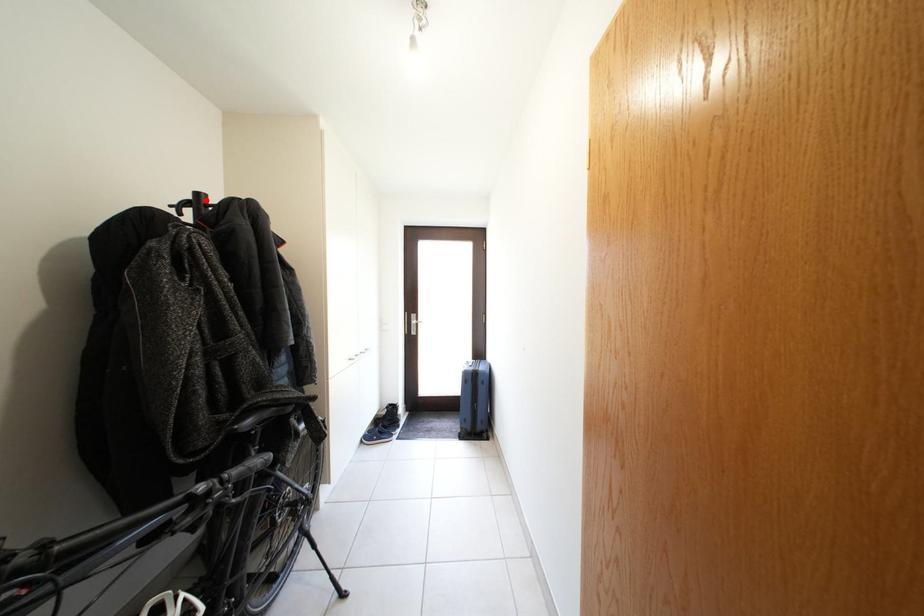
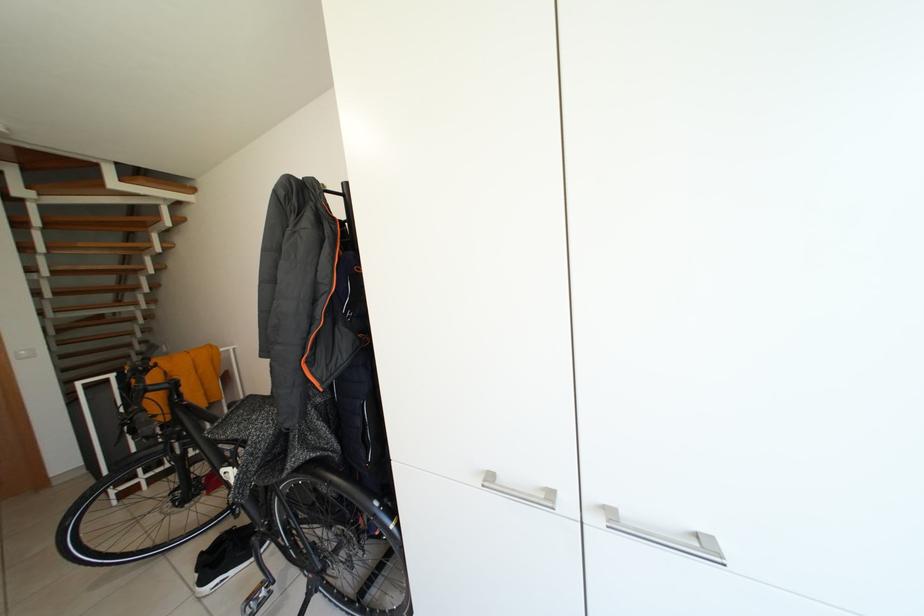
Question: I am providing you with two images of the same scene from different viewpoints. A red point is marked on the first image. At the location where the point appears in image 1, is it still visible in image 2?

Choices:
 (A) Yes
 (B) No

Answer: (B)